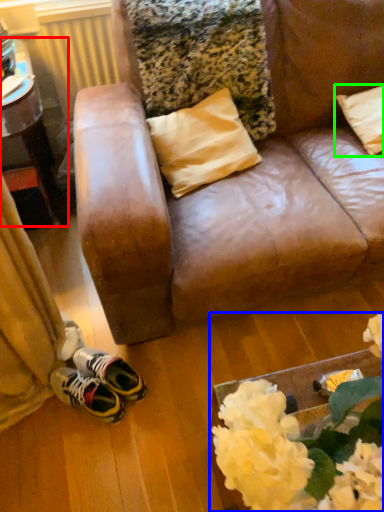
Question: Considering the real-world distances, which object is closest to table (highlighted by a red box)? floral arrangement (highlighted by a blue box) or pillow (highlighted by a green box).

Choices:
 (A) floral arrangement
 (B) pillow

Answer: (B)